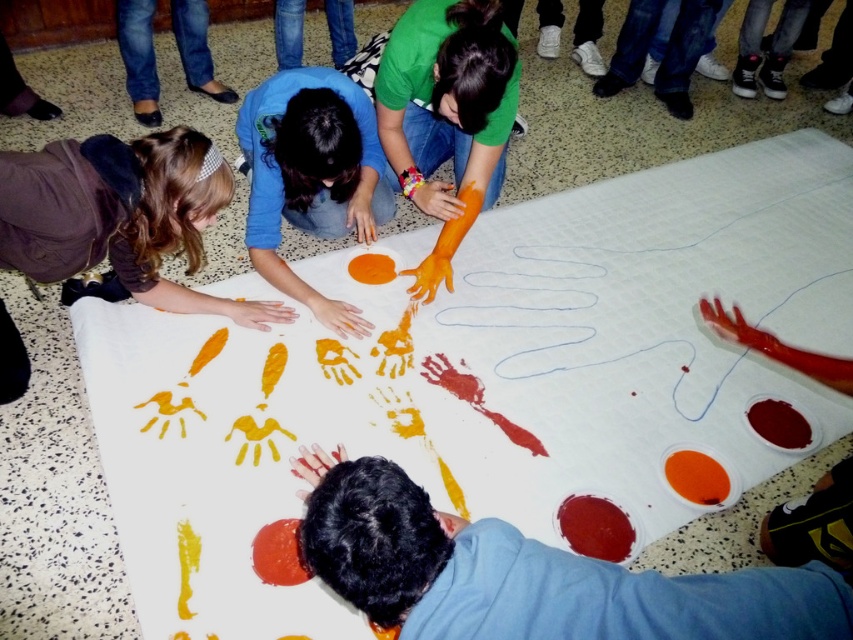
You are organizing a community art event and need to ensure there is enough space for participants to move around. Looking at the image, which object takes up more horizontal space between the brown fuzzy jacket at lower left and the matte orange handprint at center?

The brown fuzzy jacket at lower left is wider than the matte orange handprint at center, so it takes up more horizontal space.